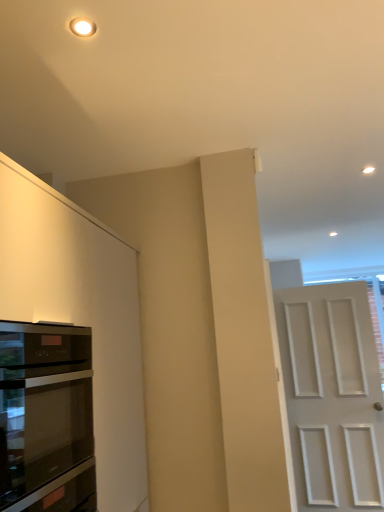
Describe the element at coordinates (332, 396) in the screenshot. I see `white matte door at right` at that location.

Find the location of a particular element. The image size is (384, 512). black glass oven at left is located at coordinates (46, 418).

Identify the location of matte white cabinet at left. (81, 315).

From the image's perspective, is white matte door at right above black glass oven at left?

Incorrect, from the image's perspective, white matte door at right is lower than black glass oven at left.

Which is more to the right, white matte door at right or black glass oven at left?

white matte door at right.

In the scene shown: Is white matte door at right oriented away from black glass oven at left?

No, white matte door at right's orientation is not away from black glass oven at left.

Is black glass oven at left at the back of matte white cabinet at left?

That's right, matte white cabinet at left is facing away from black glass oven at left.

The width and height of the screenshot is (384, 512). What are the coordinates of `oven on the right side of matte white cabinet at left` in the screenshot? It's located at coord(46,418).

Can you tell me how much matte white cabinet at left and black glass oven at left differ in facing direction?

matte white cabinet at left and black glass oven at left are facing 0.0542 degrees away from each other.

From the image's perspective, is matte white cabinet at left located above or below black glass oven at left?

matte white cabinet at left is below black glass oven at left.

From a real-world perspective, is black glass oven at left positioned above or below white matte door at right?

Clearly, from a real-world perspective, black glass oven at left is above white matte door at right.

Is point (24, 452) in front of point (330, 356)?

Yes, point (24, 452) is closer to viewer.

Is black glass oven at left beside white matte door at right?

No, black glass oven at left is not next to white matte door at right.

Considering the points (302, 420) and (46, 319), which point is behind, point (302, 420) or point (46, 319)?

Positioned behind is point (302, 420).

Is the position of white matte door at right less distant than that of matte white cabinet at left?

No, the depth of white matte door at right is greater than that of matte white cabinet at left.

Is white matte door at right facing towards matte white cabinet at left?

No, white matte door at right is not aimed at matte white cabinet at left.

Which is more to the left, white matte door at right or matte white cabinet at left?

From the viewer's perspective, matte white cabinet at left appears more on the left side.

Based on the photo, which is closer to the camera, (25, 470) or (141, 385)?

Point (25, 470) appears to be closer to the viewer than point (141, 385).

Looking at this image, from a real-world perspective, is black glass oven at left beneath matte white cabinet at left?

Indeed, from a real-world perspective, black glass oven at left is positioned beneath matte white cabinet at left.

Considering the relative sizes of black glass oven at left and matte white cabinet at left in the image provided, is black glass oven at left bigger than matte white cabinet at left?

Actually, black glass oven at left might be smaller than matte white cabinet at left.

Is matte white cabinet at left located outside white matte door at right?

Yes, matte white cabinet at left is outside of white matte door at right.

Is matte white cabinet at left wider than white matte door at right?

Correct, the width of matte white cabinet at left exceeds that of white matte door at right.

Which is more to the left, matte white cabinet at left or white matte door at right?

Positioned to the left is matte white cabinet at left.

Identify the location of cabinetry located on the left of white matte door at right. The image size is (384, 512). (81, 315).

Where is `oven in front of the white matte door at right`? The width and height of the screenshot is (384, 512). oven in front of the white matte door at right is located at coordinates (46, 418).

Find the location of a particular element. The image size is (384, 512). cabinetry located above the black glass oven at left (from a real-world perspective) is located at coordinates (81, 315).

Considering their positions, is white matte door at right positioned closer to black glass oven at left than matte white cabinet at left?

Based on the image, matte white cabinet at left appears to be nearer to black glass oven at left.

Consider the image. Which object lies further to the anchor point black glass oven at left, matte white cabinet at left or white matte door at right?

The object further to black glass oven at left is white matte door at right.

Estimate the real-world distances between objects in this image. Which object is further from white matte door at right, black glass oven at left or matte white cabinet at left?

black glass oven at left lies further to white matte door at right than the other object.

Based on their spatial positions, is white matte door at right or black glass oven at left further from matte white cabinet at left?

white matte door at right is further to matte white cabinet at left.

Looking at the image, which one is located closer to white matte door at right, matte white cabinet at left or black glass oven at left?

matte white cabinet at left is positioned closer to the anchor white matte door at right.

Which object lies further to the anchor point matte white cabinet at left, black glass oven at left or white matte door at right?

white matte door at right lies further to matte white cabinet at left than the other object.

You are a GUI agent. You are given a task and a screenshot of the screen. Output one action in this format:
    pyautogui.click(x=<x>, y=<y>)
    Task: Click on the oven positioned between matte white cabinet at left and white matte door at right from near to far
    This screenshot has height=512, width=384.
    Given the screenshot: What is the action you would take?
    pyautogui.click(x=46, y=418)